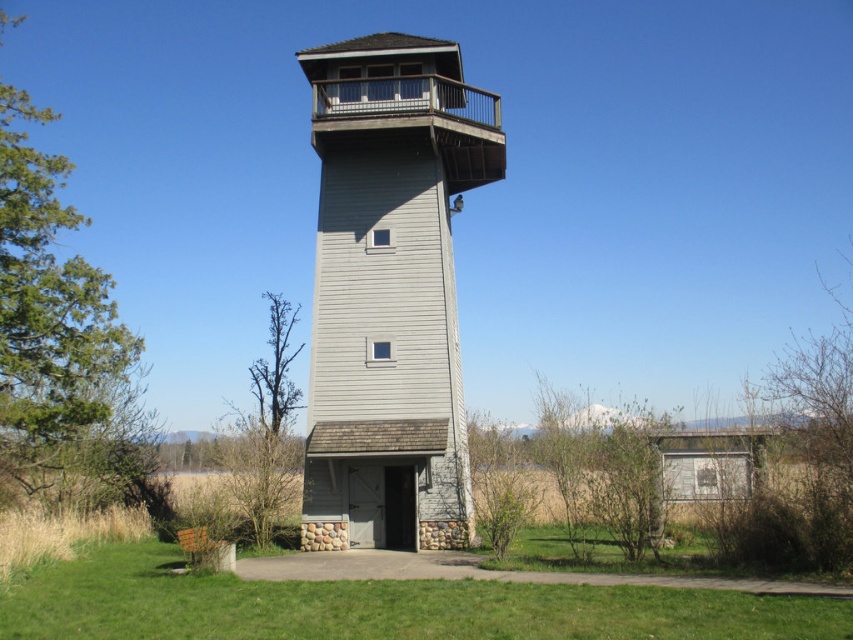
Between gray wood tower at center and green grass at lower center, which one is positioned higher?

gray wood tower at center is above.

Who is more forward, (374, 102) or (152, 632)?

Point (152, 632) is in front.

At what (x,y) coordinates should I click in order to perform the action: click on gray wood tower at center. Please return your answer as a coordinate pair (x, y). Image resolution: width=853 pixels, height=640 pixels. Looking at the image, I should click on [x=390, y=291].